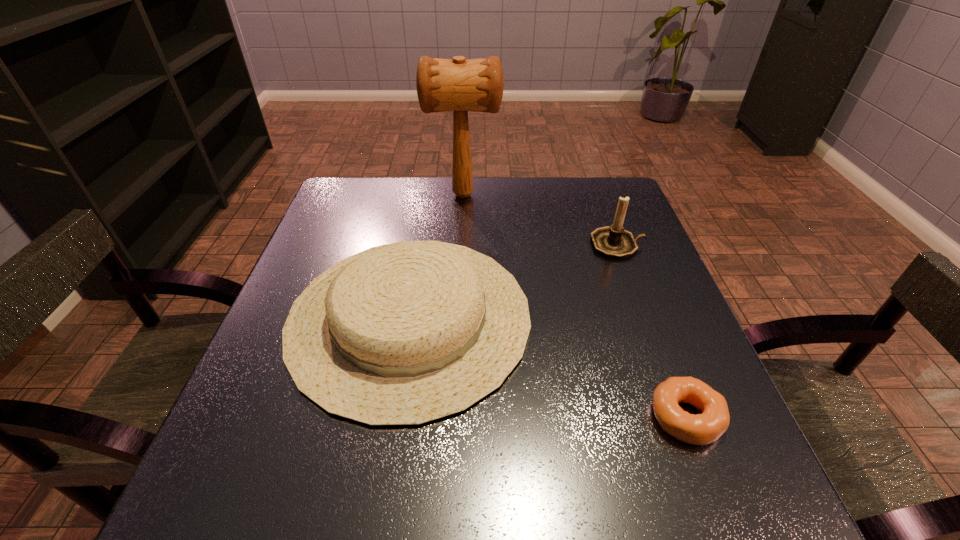
The width and height of the screenshot is (960, 540). What are the coordinates of `unoccupied area between the candle holder and the doughnut` in the screenshot? It's located at (652, 331).

I want to click on empty space that is in between the mallet and the shortest object, so click(x=575, y=306).

Image resolution: width=960 pixels, height=540 pixels. I want to click on blank region between the sunhat and the shortest object, so (548, 367).

At what (x,y) coordinates should I click in order to perform the action: click on free point between the tallest object and the second tallest object. Please return your answer as a coordinate pair (x, y). This screenshot has width=960, height=540. Looking at the image, I should click on (540, 220).

This screenshot has height=540, width=960. Identify the location of free space that is in between the candle holder and the mallet. (540, 220).

You are a GUI agent. You are given a task and a screenshot of the screen. Output one action in this format:
    pyautogui.click(x=<x>, y=<y>)
    Task: Click on the object that is the nearest to the doughnut
    
    Given the screenshot: What is the action you would take?
    pyautogui.click(x=403, y=334)

Image resolution: width=960 pixels, height=540 pixels. I want to click on object that is the second nearest to the sunhat, so click(613, 241).

The width and height of the screenshot is (960, 540). What are the coordinates of `vacant area that satisfies the following two spatial constraints: 1. on the back side of the candle holder; 2. on the strike surface of the mallet` in the screenshot? It's located at (599, 195).

Image resolution: width=960 pixels, height=540 pixels. I want to click on vacant space that satisfies the following two spatial constraints: 1. on the strike surface of the doughnut; 2. on the left side of the farthest object, so click(451, 417).

The image size is (960, 540). Identify the location of vacant space that satisfies the following two spatial constraints: 1. on the strike surface of the shortest object; 2. on the right side of the farthest object. (451, 417).